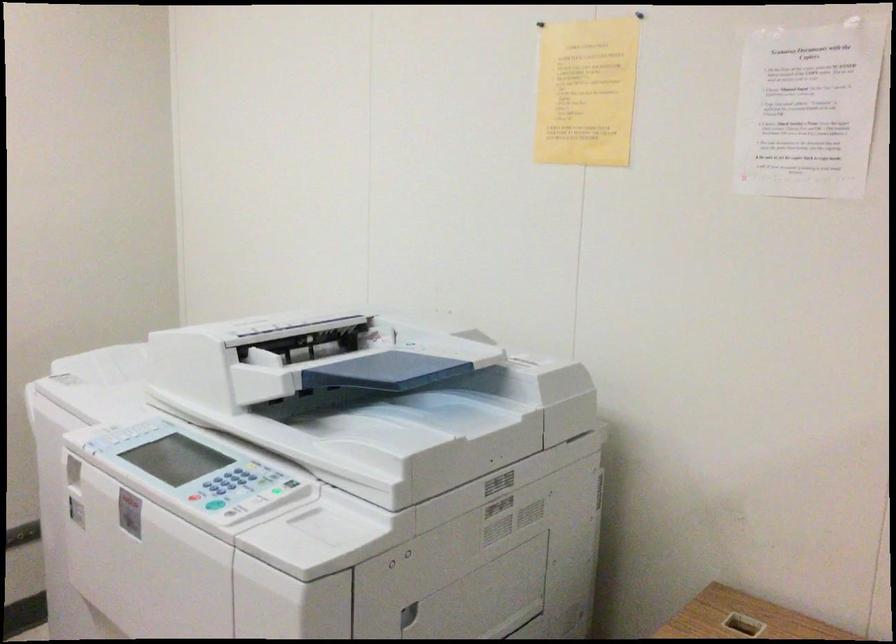
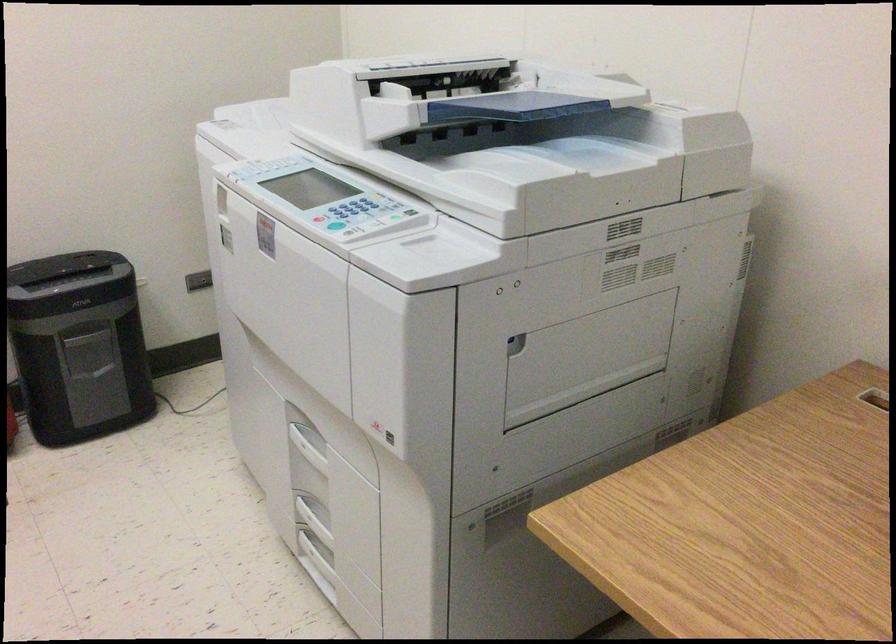
Locate, in the second image, the point that corresponds to point 220,488 in the first image.

(343, 214)